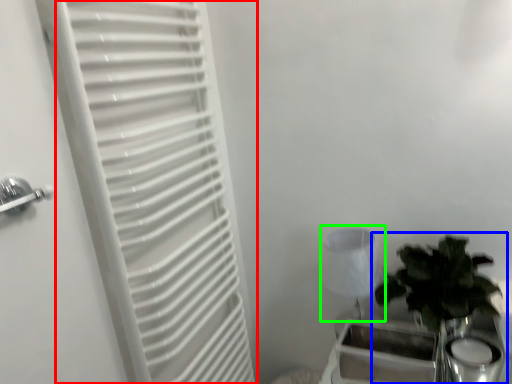
Question: Which object is the closest to the curtain (highlighted by a red box)? Choose among these: houseplant (highlighted by a blue box) or lamp (highlighted by a green box).

Choices:
 (A) houseplant
 (B) lamp

Answer: (B)